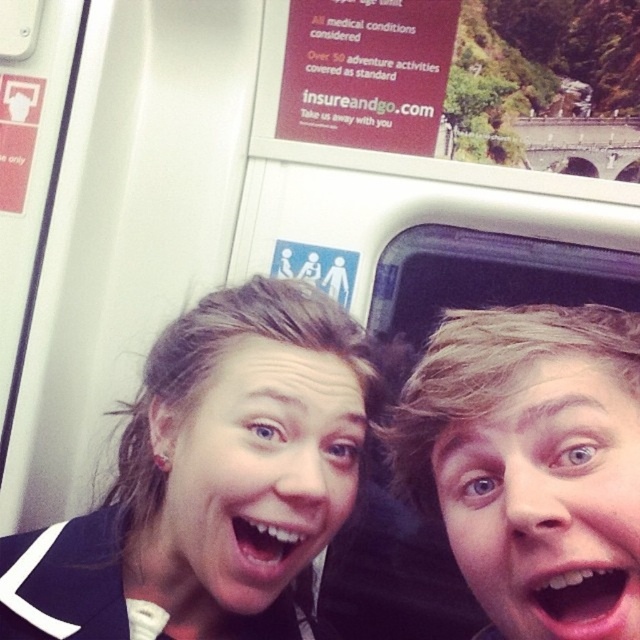
Question: Is black fabric at center positioned at the back of pink glossy lips at center?

Choices:
 (A) no
 (B) yes

Answer: (B)

Question: Is pink glossy lips at center above white glossy teeth at center?

Choices:
 (A) yes
 (B) no

Answer: (A)

Question: Is black fabric at center to the right of white glossy teeth at center from the viewer's perspective?

Choices:
 (A) yes
 (B) no

Answer: (B)

Question: Which point is farther from the camera taking this photo?

Choices:
 (A) (600, 621)
 (B) (304, 563)

Answer: (B)

Question: Which point is closer to the camera?

Choices:
 (A) black fabric at center
 (B) white glossy teeth at center
 (C) blonde hair at right

Answer: (C)

Question: Which of the following is the farthest from the observer?

Choices:
 (A) white glossy teeth at center
 (B) blonde hair at right
 (C) black fabric at center

Answer: (A)